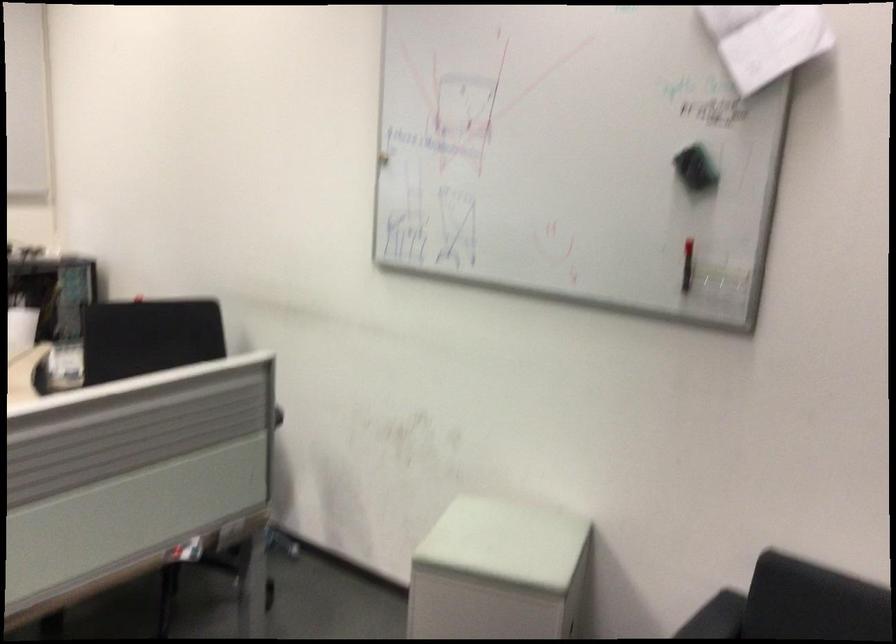
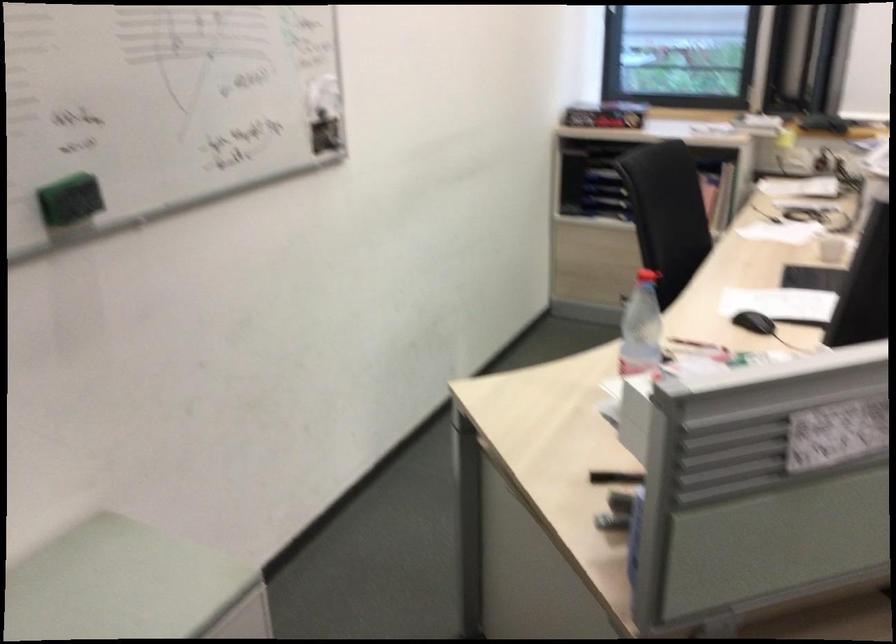
The images are taken continuously from a first-person perspective. In which direction is your viewpoint rotating?

The rotation direction of the camera is left-down.